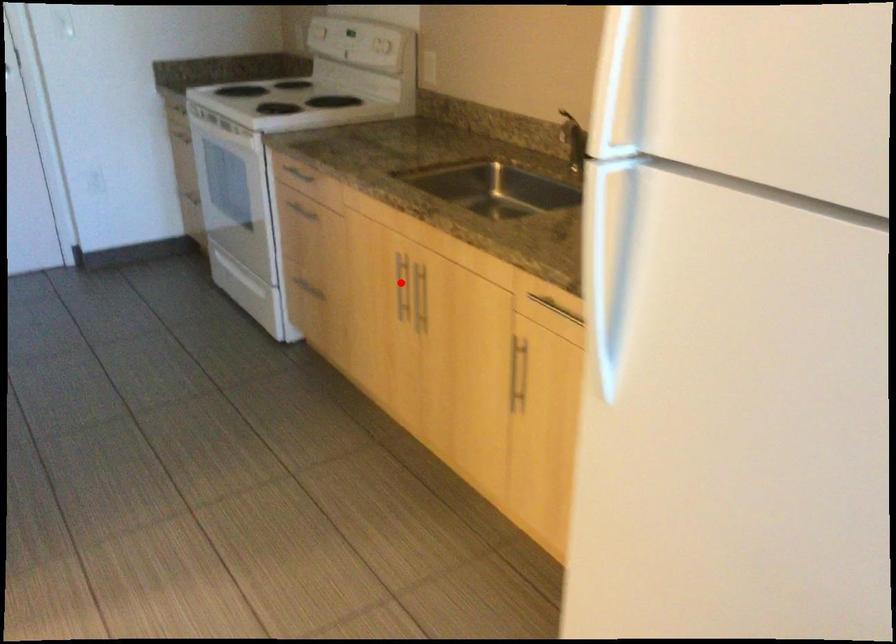
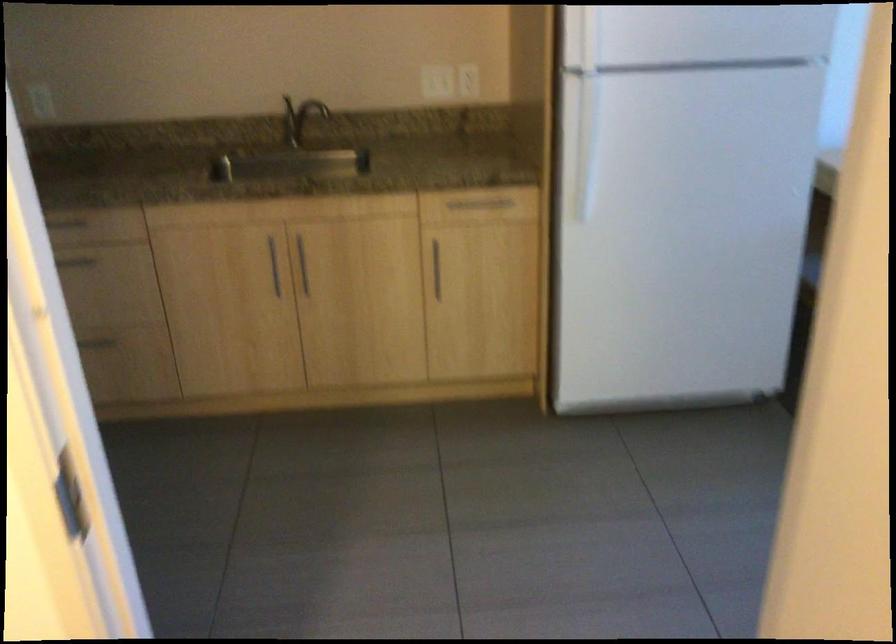
Question: I am providing you with two images of the same scene from different viewpoints. A red point is shown in image1. For the corresponding object point in image2, is it positioned nearer or farther from the camera?

Choices:
 (A) Nearer
 (B) Farther

Answer: (B)